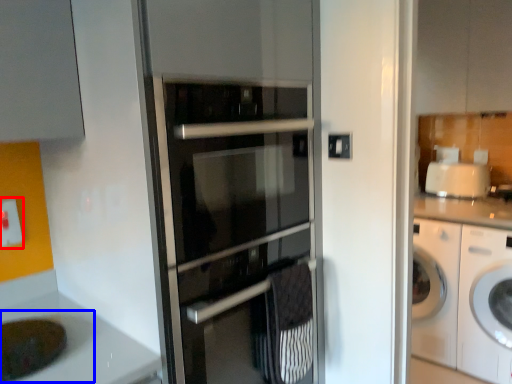
Question: Which object appears farthest to the camera in this image, electric outlet (highlighted by a red box) or sink (highlighted by a blue box)?

Choices:
 (A) electric outlet
 (B) sink

Answer: (A)